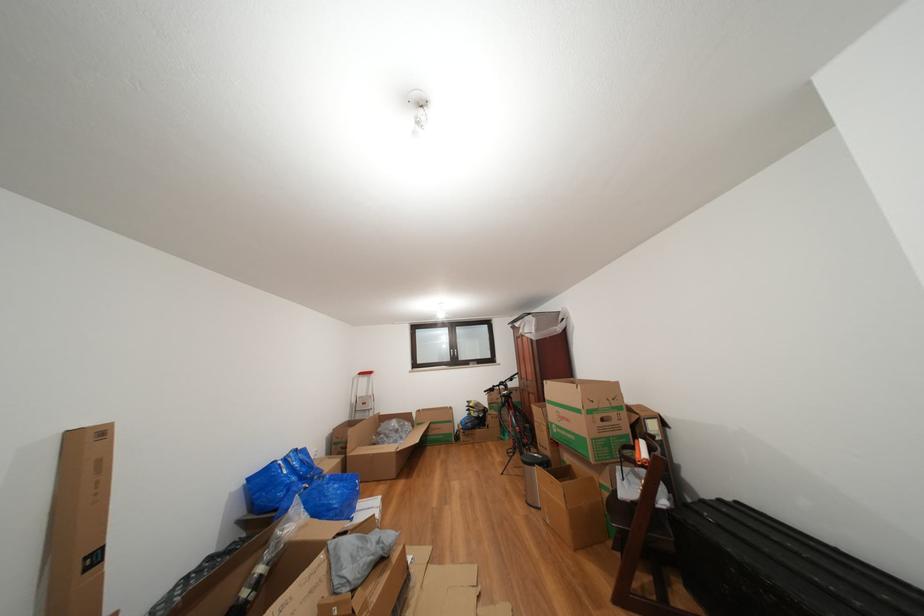
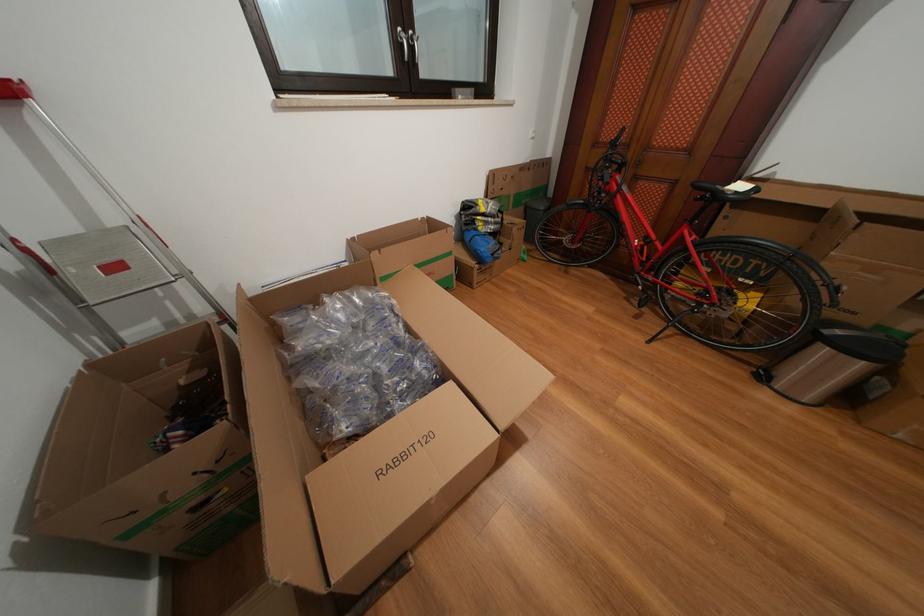
The point at [372,408] is marked in the first image. Where is the corresponding point in the second image?

(124, 273)